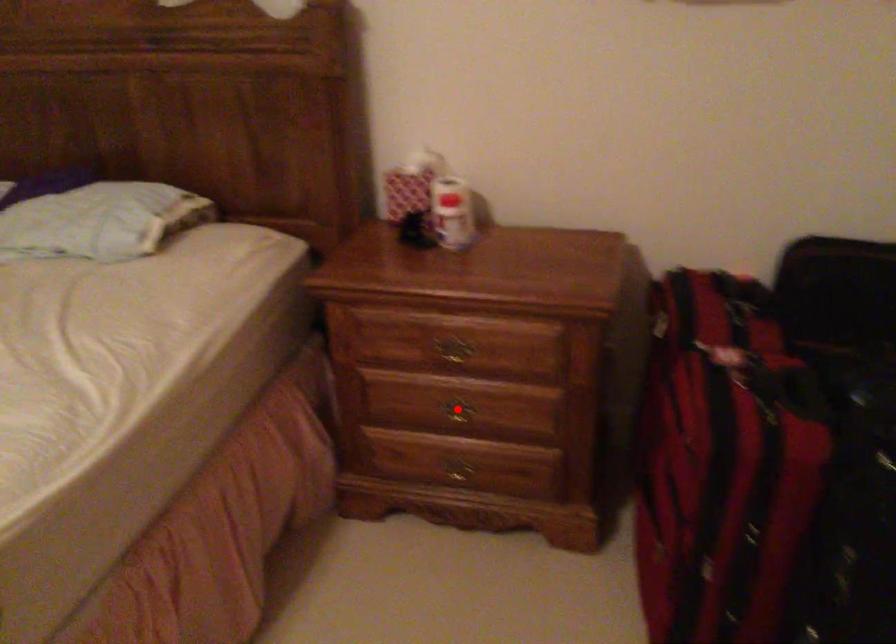
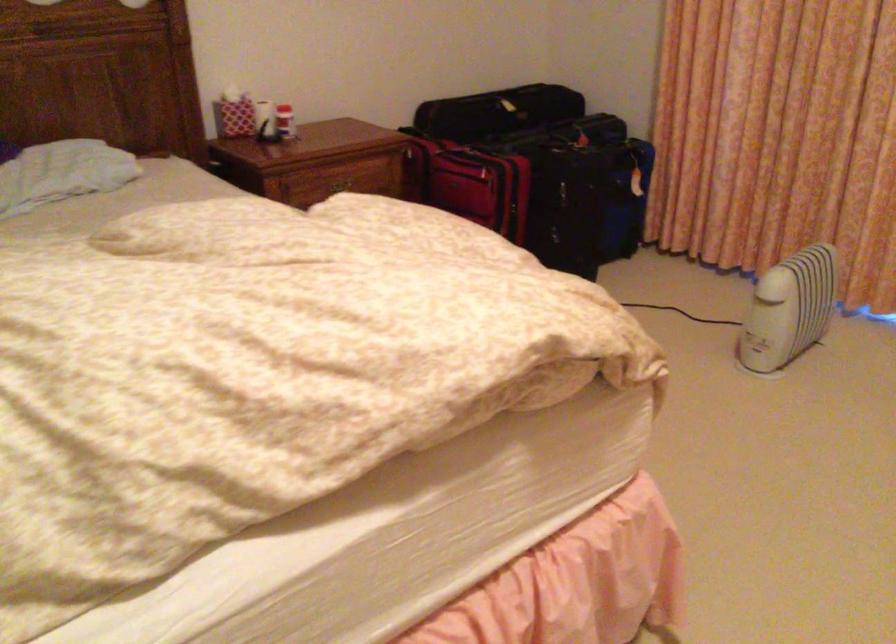
Question: I am providing you with two images of the same scene from different viewpoints. A red point is marked on the first image. Can you still see the location of the red point in image 2?

Choices:
 (A) Yes
 (B) No

Answer: (B)